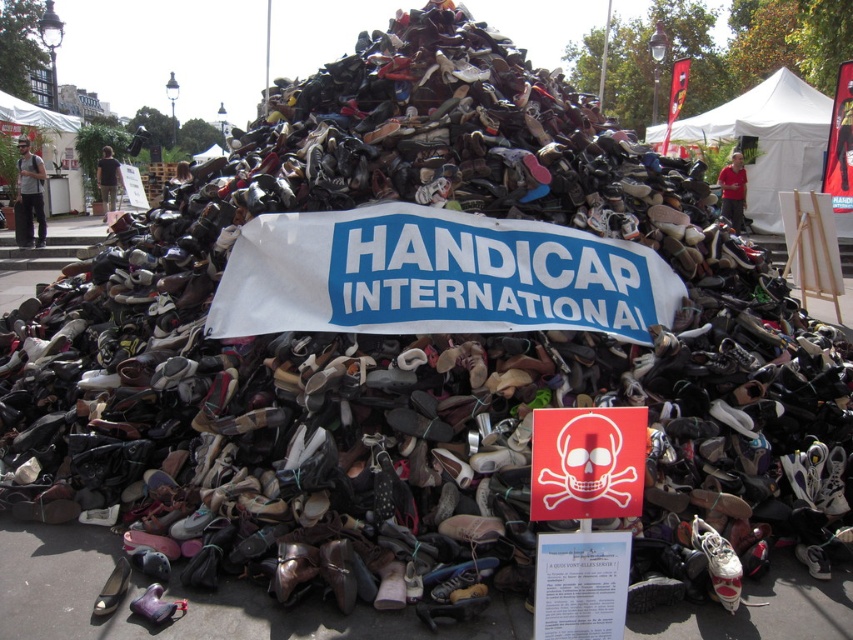
Question: Does white matte shoe at center appear on the right side of shiny metallic shoe at lower left?

Choices:
 (A) yes
 (B) no

Answer: (A)

Question: Among these objects, which one is farthest from the camera?

Choices:
 (A) white paper at center
 (B) white matte shoe at center
 (C) red skull sign at center
 (D) shiny metallic shoe at lower left

Answer: (B)

Question: Estimate the real-world distances between objects in this image. Which object is farther from the red skull sign at center?

Choices:
 (A) shiny metallic shoe at lower left
 (B) white paper at center
 (C) white matte shoe at center

Answer: (A)

Question: Can you confirm if red skull sign at center is wider than shiny metallic shoe at lower left?

Choices:
 (A) no
 (B) yes

Answer: (B)

Question: Does white matte shoe at center have a larger size compared to shiny metallic shoe at lower left?

Choices:
 (A) yes
 (B) no

Answer: (A)

Question: Which object is positioned closest to the shiny metallic shoe at lower left?

Choices:
 (A) red skull sign at center
 (B) white paper at center
 (C) white matte shoe at center

Answer: (B)